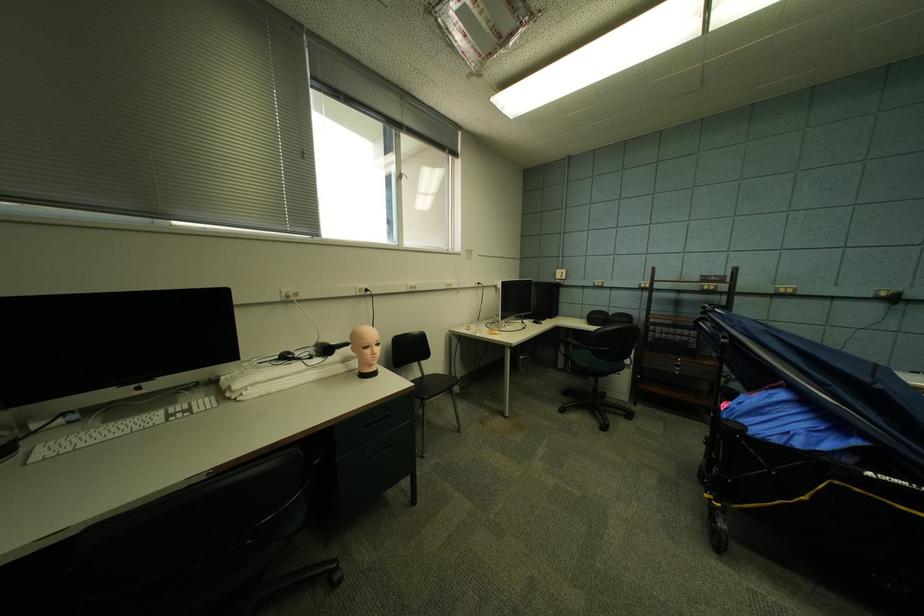
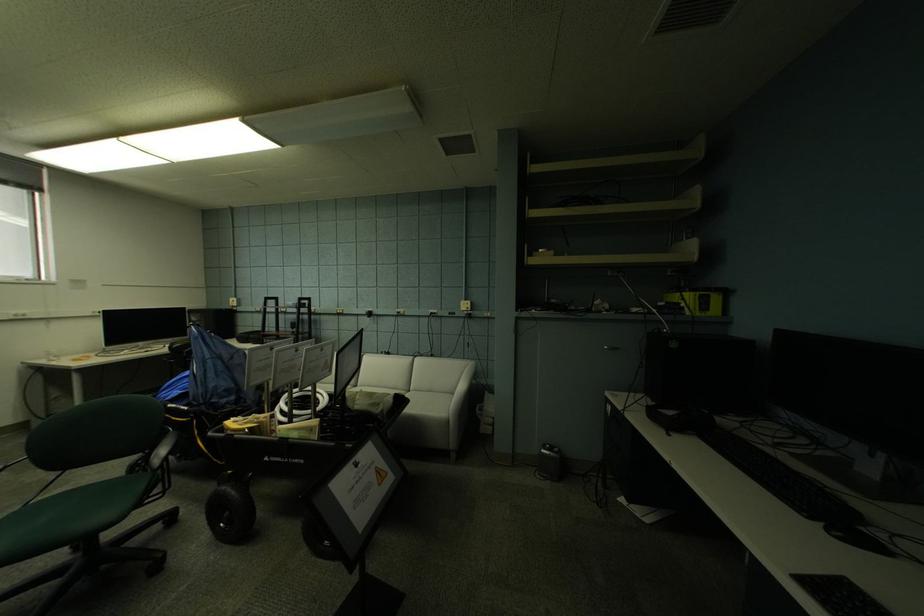
In a continuous first-person perspective shot, in which direction is the camera moving?

The cameraman walked toward right, backward.